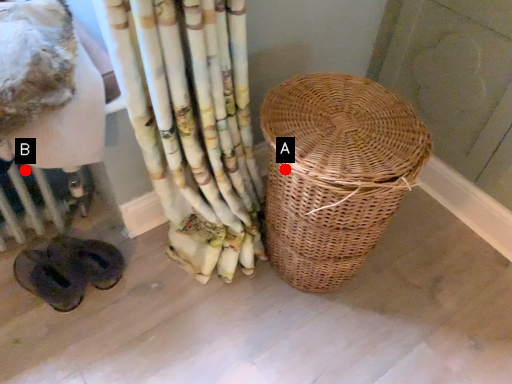
Question: Two points are circled on the image, labeled by A and B beside each circle. Which point is further to the camera?

Choices:
 (A) A is further
 (B) B is further

Answer: (B)